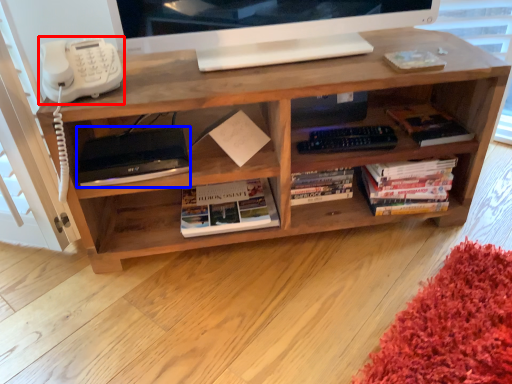
Question: Which object is further to the camera taking this photo, corded phone (highlighted by a red box) or equipment (highlighted by a blue box)?

Choices:
 (A) corded phone
 (B) equipment

Answer: (B)